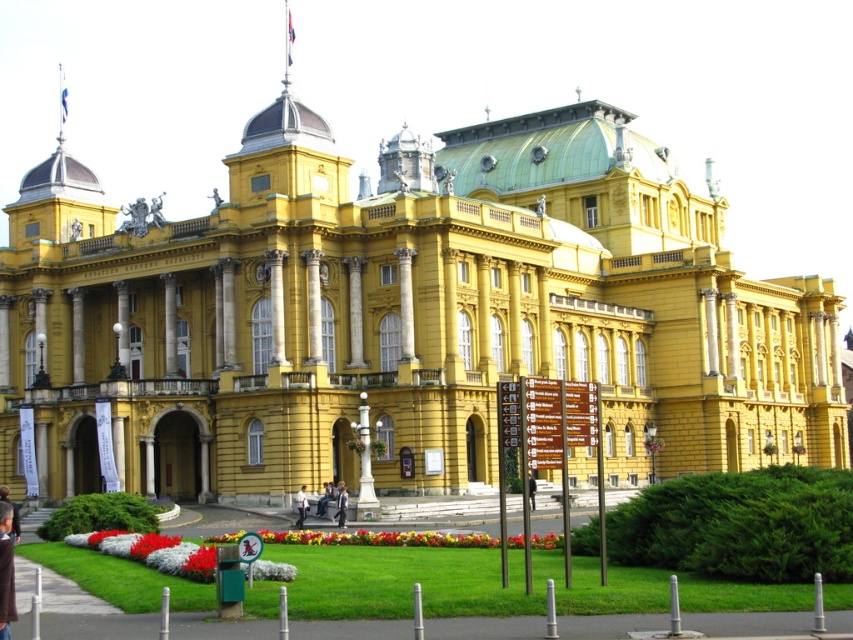
Consider the image. Is brown leather jacket at lower left above light blue shirt at center?

Indeed, brown leather jacket at lower left is positioned over light blue shirt at center.

The width and height of the screenshot is (853, 640). I want to click on brown leather jacket at lower left, so click(x=6, y=572).

Find the location of a particular element. This screenshot has width=853, height=640. brown leather jacket at lower left is located at coordinates (6, 572).

Consider the image. Is light blue jeans at center below black leather jacket at center?

Correct, light blue jeans at center is located below black leather jacket at center.

The width and height of the screenshot is (853, 640). Identify the location of light blue jeans at center. (323, 499).

Locate an element on the screen. The image size is (853, 640). light blue jeans at center is located at coordinates (323, 499).

At what (x,y) coordinates should I click in order to perform the action: click on light blue jeans at center. Please return your answer as a coordinate pair (x, y). Image resolution: width=853 pixels, height=640 pixels. Looking at the image, I should click on (323, 499).

Who is positioned more to the left, light blue fabric jacket at center or light blue jeans at center?

Positioned to the left is light blue jeans at center.

Consider the image. Who is more distant from viewer, [340,486] or [321,509]?

The point [321,509] is more distant.

Which is in front, point (343, 488) or point (328, 484)?

Positioned in front is point (343, 488).

Locate an element on the screen. light blue fabric jacket at center is located at coordinates click(x=341, y=506).